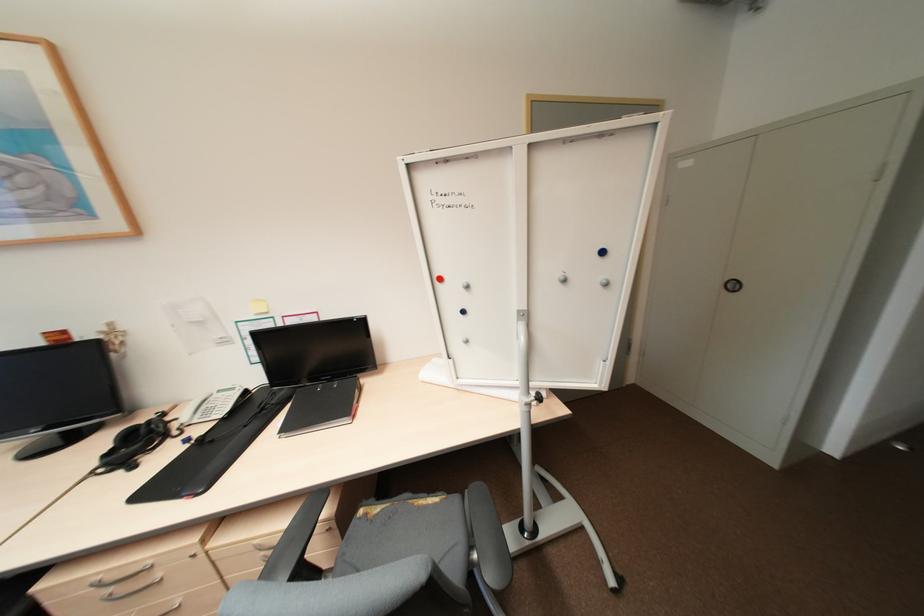
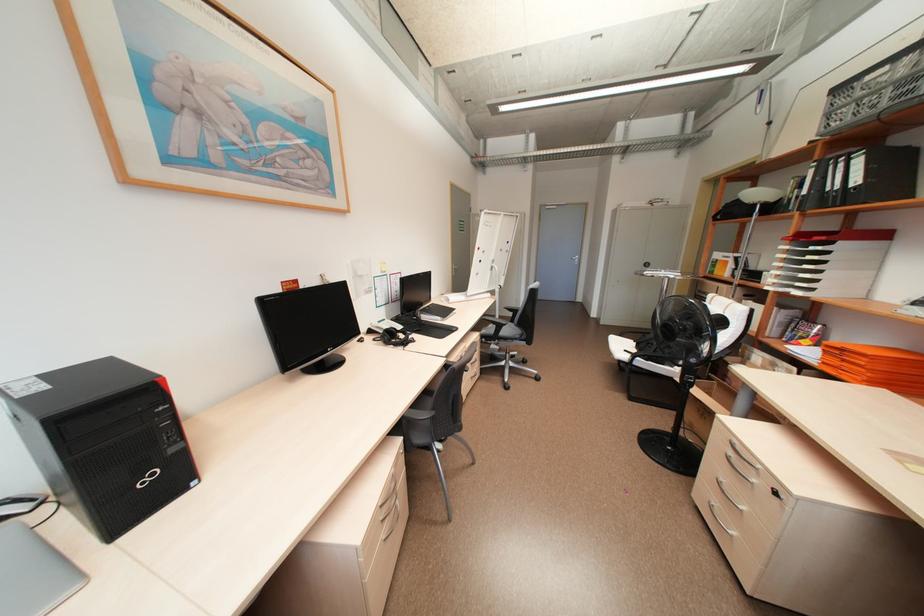
The point at (224, 391) is marked in the first image. Where is the corresponding point in the second image?

(384, 322)